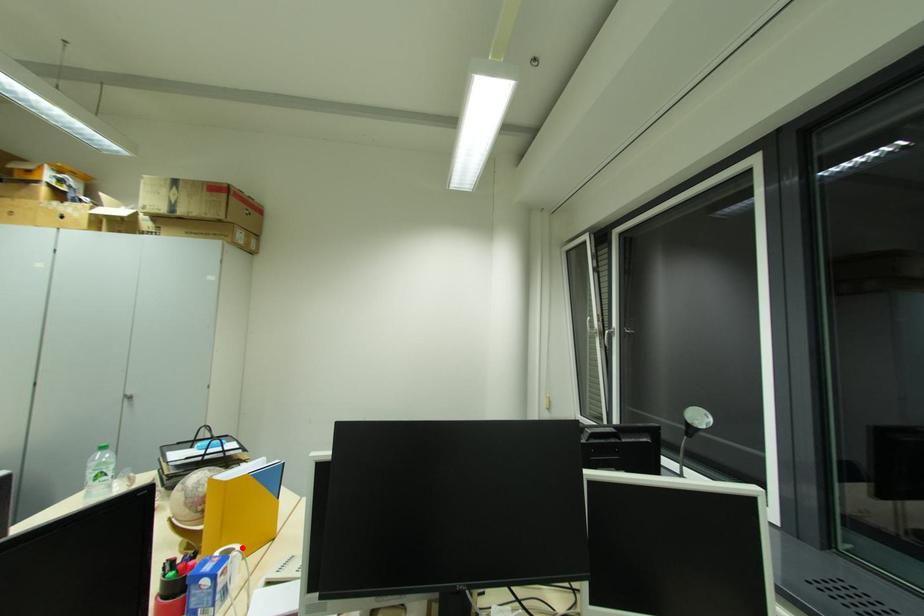
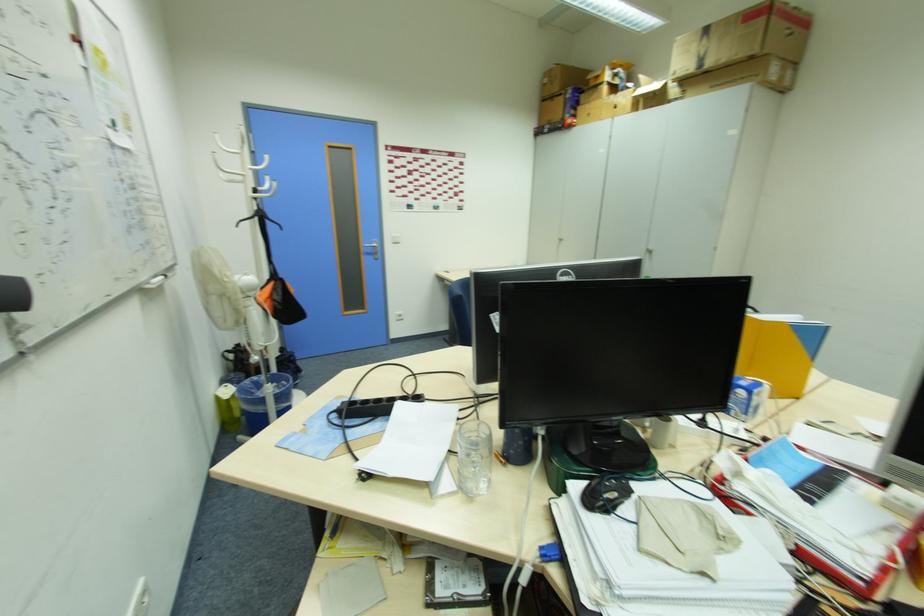
Find the pixel in the second image that matches the highlighted location in the first image.

(772, 384)